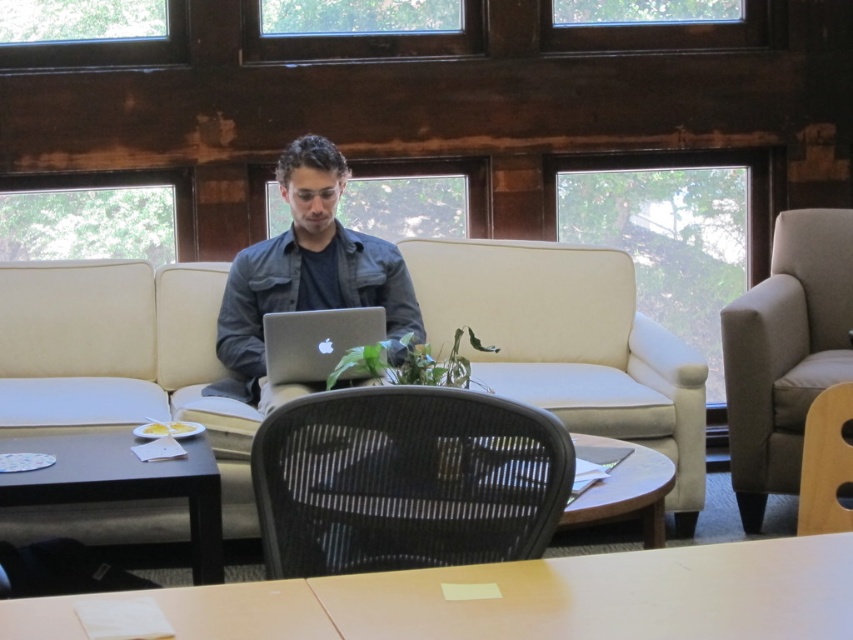
At what (x,y) coordinates should I click in order to perform the action: click on gray fabric armchair at right. Please return your answer as a coordinate pair (x, y). The height and width of the screenshot is (640, 853). Looking at the image, I should click on tap(785, 353).

How far apart are gray fabric armchair at right and matte black shirt at center?

1.57 meters

At what (x,y) coordinates should I click in order to perform the action: click on gray fabric armchair at right. Please return your answer as a coordinate pair (x, y). The height and width of the screenshot is (640, 853). Looking at the image, I should click on (785, 353).

Measure the distance from light brown wooden table at center to black wood table at lower left.

A distance of 4.08 feet exists between light brown wooden table at center and black wood table at lower left.

Between light brown wooden table at center and black wood table at lower left, which one has more height?

With more height is black wood table at lower left.

The image size is (853, 640). Find the location of `light brown wooden table at center`. light brown wooden table at center is located at coordinates (517, 598).

Does light brown wooden table at center appear over matte black shirt at center?

No, light brown wooden table at center is not above matte black shirt at center.

Is point (759, 563) more distant than point (300, 266)?

That is False.

Where is `light brown wooden table at center`? The height and width of the screenshot is (640, 853). light brown wooden table at center is located at coordinates (517, 598).